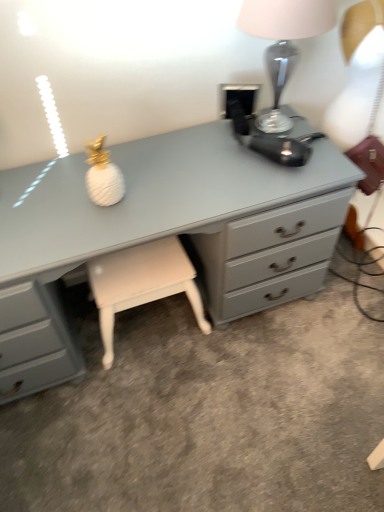
The image size is (384, 512). I want to click on free point above matte gray chest of drawers at center (from a real-world perspective), so click(x=132, y=185).